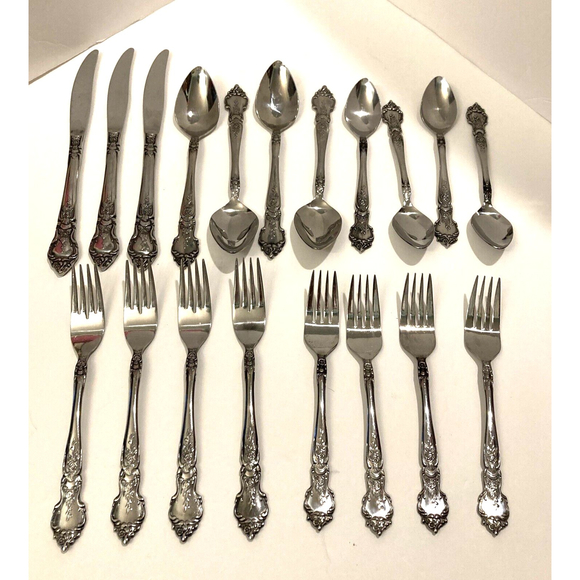
Identify the location of spoon. (183, 184), (231, 175), (279, 121), (325, 154), (360, 140), (396, 171), (444, 162), (485, 176).